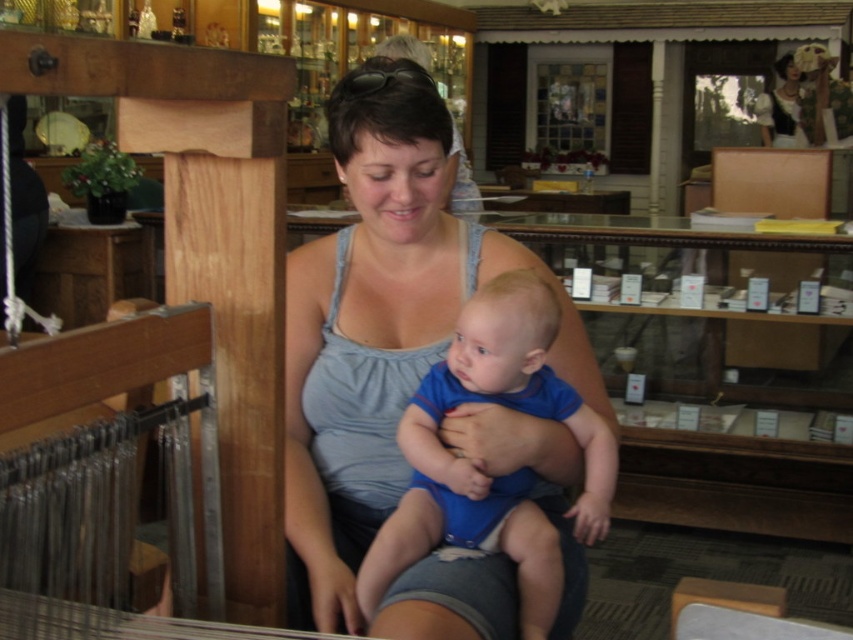
Who is shorter, gray fabric tank top at center or matte black dress at upper right?

With less height is gray fabric tank top at center.

Who is more distant from viewer, (395, 88) or (755, 113)?

Positioned behind is point (755, 113).

Who is more forward, (434, 161) or (769, 106)?

Point (434, 161) is in front.

Find the location of a particular element. This screenshot has width=853, height=640. gray fabric tank top at center is located at coordinates (380, 326).

Who is higher up, blue cotton onesie at center or matte black dress at upper right?

matte black dress at upper right

Is point (488, 339) behind point (769, 106)?

That is False.

Is point (415, 541) closer to viewer compared to point (790, 100)?

That is True.

At what (x,y) coordinates should I click in order to perform the action: click on blue cotton onesie at center. Please return your answer as a coordinate pair (x, y). This screenshot has height=640, width=853. Looking at the image, I should click on (477, 468).

Based on the photo, does gray fabric tank top at center have a larger size compared to blue cotton onesie at center?

Yes.

Measure the distance from gray fabric tank top at center to blue cotton onesie at center.

gray fabric tank top at center is 4.24 inches from blue cotton onesie at center.

Does point (428, 156) lie in front of point (474, 296)?

No.

Where is `gray fabric tank top at center`? This screenshot has height=640, width=853. gray fabric tank top at center is located at coordinates (380, 326).